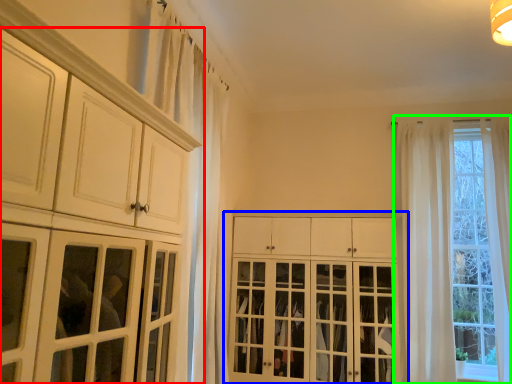
Question: Which object is the closest to the cabinetry (highlighted by a red box)? Choose among these: cabinetry (highlighted by a blue box) or window (highlighted by a green box).

Choices:
 (A) cabinetry
 (B) window

Answer: (A)